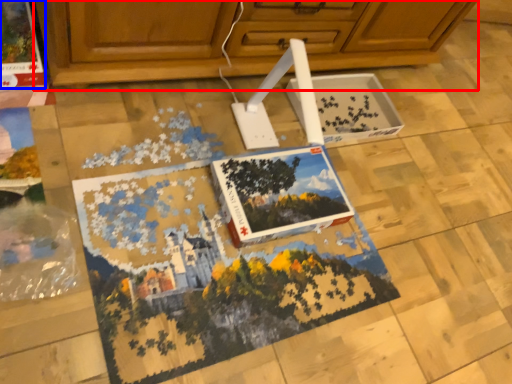
Question: Among these objects, which one is nearest to the camera, cabinetry (highlighted by a red box) or magazine (highlighted by a blue box)?

Choices:
 (A) cabinetry
 (B) magazine

Answer: (A)